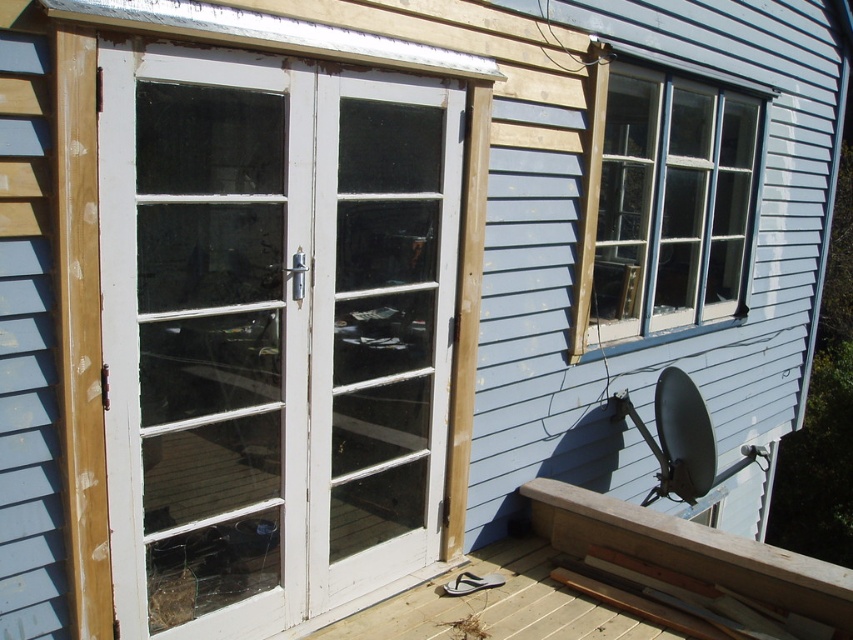
Question: Observing the image, what is the correct spatial positioning of white wood screen door at center in reference to white wood door at center?

Choices:
 (A) left
 (B) right

Answer: (A)

Question: Considering the real-world distances, which object is farthest from the white wood door at center?

Choices:
 (A) clear glass window at upper right
 (B) white wood screen door at center

Answer: (A)

Question: Can you confirm if white wood door at center is wider than clear glass window at upper right?

Choices:
 (A) no
 (B) yes

Answer: (A)

Question: Which is farther from the white wood door at center?

Choices:
 (A) white wood screen door at center
 (B) clear glass window at upper right

Answer: (B)

Question: Which point is closer to the camera taking this photo?

Choices:
 (A) (316, 296)
 (B) (99, 84)

Answer: (B)

Question: Where is white wood screen door at center located in relation to white wood door at center in the image?

Choices:
 (A) right
 (B) left

Answer: (B)